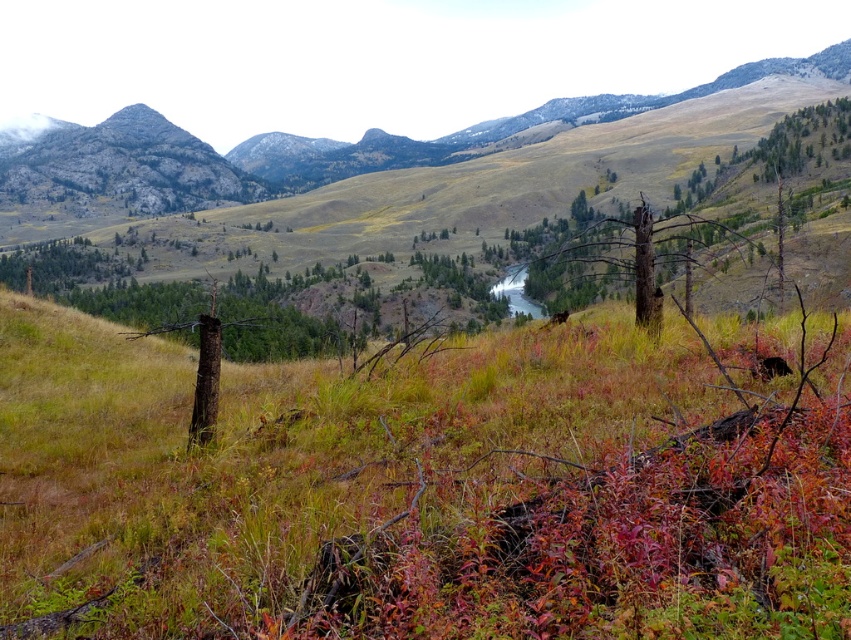
Question: Which of the following is the closest to the observer?

Choices:
 (A) brown rough tree at center
 (B) green grassy at center

Answer: (B)

Question: Does green grassy at center appear on the left side of brown rough tree at center?

Choices:
 (A) yes
 (B) no

Answer: (A)

Question: Can you confirm if green grassy at center is positioned above brown rough tree at center?

Choices:
 (A) yes
 (B) no

Answer: (B)

Question: In this image, where is green grassy at center located relative to brown rough tree at center?

Choices:
 (A) above
 (B) below

Answer: (B)

Question: Among these points, which one is farthest from the camera?

Choices:
 (A) (307, 547)
 (B) (648, 221)

Answer: (B)